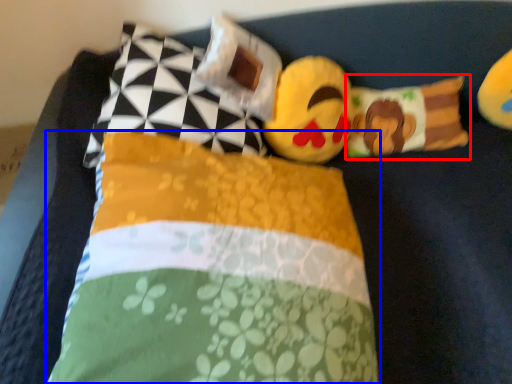
Question: Which object is further to the camera taking this photo, pillow (highlighted by a red box) or pillow (highlighted by a blue box)?

Choices:
 (A) pillow
 (B) pillow

Answer: (A)